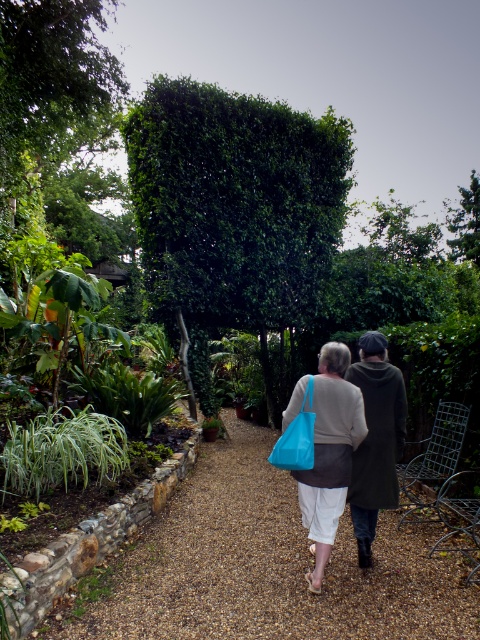
Who is more forward, (319, 124) or (385, 497)?

Point (385, 497)

Which is more to the right, green leafy hedge at center or dark green coat at center?

Positioned to the right is dark green coat at center.

Who is more forward, (322, 188) or (380, 492)?

Positioned in front is point (380, 492).

Image resolution: width=480 pixels, height=640 pixels. Find the location of `green leafy hedge at center`. green leafy hedge at center is located at coordinates (233, 211).

Consider the image. Can you confirm if dark green coat at center is thinner than blue fabric bag at center?

No.

Can you confirm if dark green coat at center is wider than blue fabric bag at center?

Indeed, dark green coat at center has a greater width compared to blue fabric bag at center.

What do you see at coordinates (375, 440) in the screenshot? The image size is (480, 640). I see `dark green coat at center` at bounding box center [375, 440].

The width and height of the screenshot is (480, 640). Identify the location of dark green coat at center. (375, 440).

Does green leafy hedge at center have a lesser height compared to blue fabric bag at center?

No, green leafy hedge at center is not shorter than blue fabric bag at center.

Find the location of `green leafy hedge at center`. green leafy hedge at center is located at coordinates (233, 211).